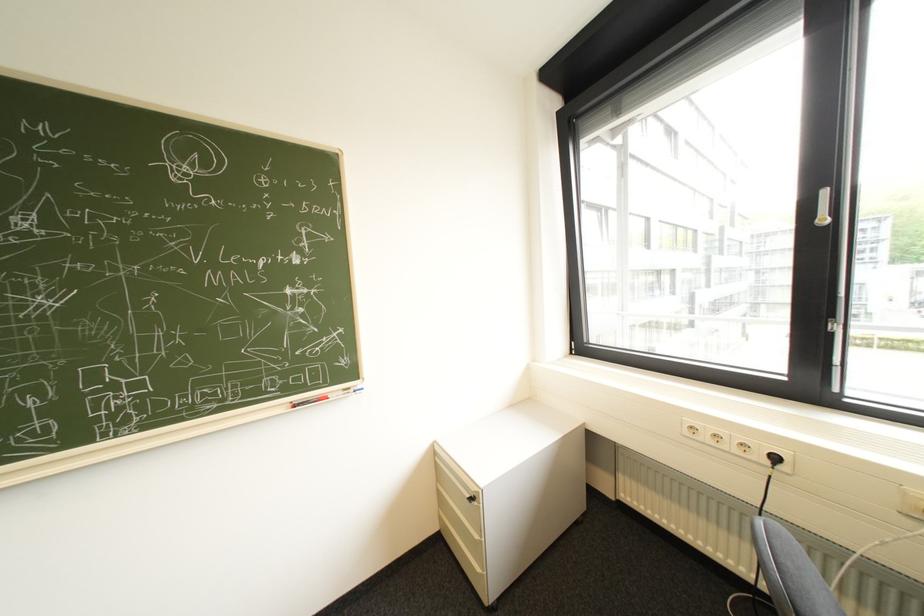
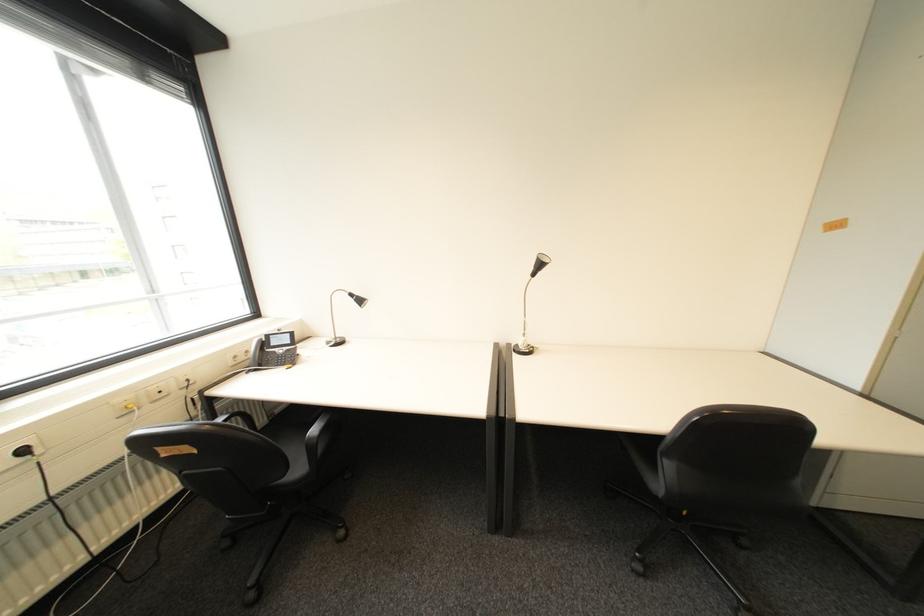
Locate, in the second image, the point that corresponds to (x=785, y=459) in the first image.

(34, 452)